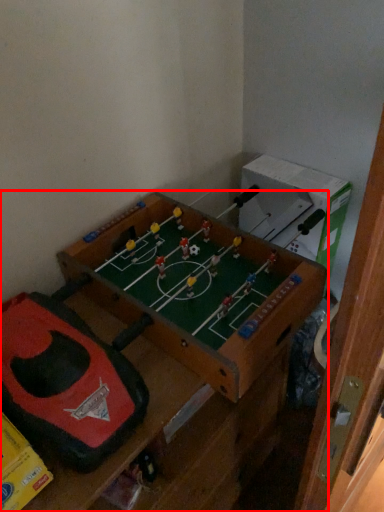
Question: From the image's perspective, considering the relative positions of furniture (annotated by the red box) and toy in the image provided, where is furniture (annotated by the red box) located with respect to the staircase?

Choices:
 (A) above
 (B) below

Answer: (B)